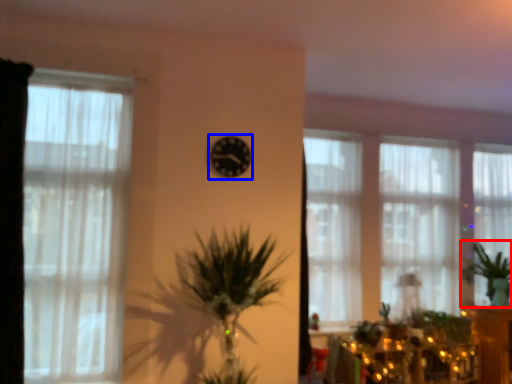
Question: Which object is further to the camera taking this photo, plant (highlighted by a red box) or clock (highlighted by a blue box)?

Choices:
 (A) plant
 (B) clock

Answer: (A)